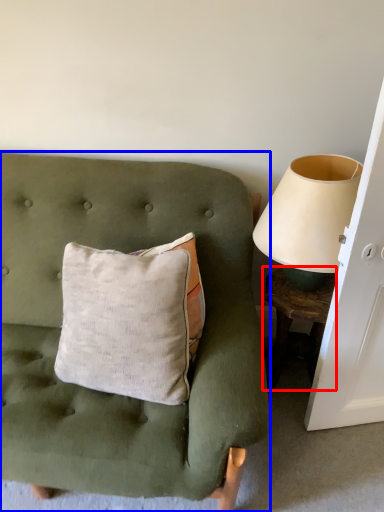
Question: Which object is further to the camera taking this photo, table (highlighted by a red box) or furniture (highlighted by a blue box)?

Choices:
 (A) table
 (B) furniture

Answer: (A)